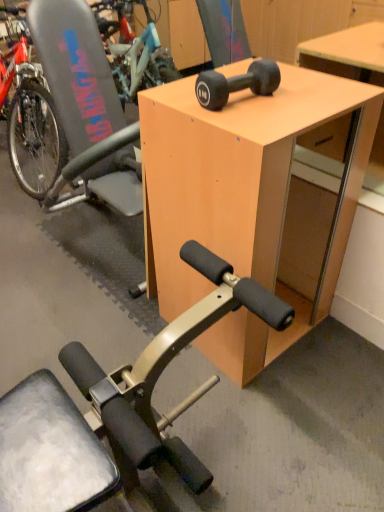
Question: Can you confirm if gray plastic swivel chair at left is bigger than black rubber dumbbell at upper center?

Choices:
 (A) yes
 (B) no

Answer: (A)

Question: Considering the relative sizes of gray plastic swivel chair at left and black rubber dumbbell at upper center in the image provided, is gray plastic swivel chair at left shorter than black rubber dumbbell at upper center?

Choices:
 (A) yes
 (B) no

Answer: (B)

Question: Is gray plastic swivel chair at left smaller than black rubber dumbbell at upper center?

Choices:
 (A) no
 (B) yes

Answer: (A)

Question: From a real-world perspective, is gray plastic swivel chair at left physically above black rubber dumbbell at upper center?

Choices:
 (A) yes
 (B) no

Answer: (B)

Question: Is the depth of gray plastic swivel chair at left less than that of black rubber dumbbell at upper center?

Choices:
 (A) no
 (B) yes

Answer: (A)

Question: Is gray plastic swivel chair at left looking in the opposite direction of black rubber dumbbell at upper center?

Choices:
 (A) yes
 (B) no

Answer: (B)

Question: Can you confirm if black rubber dumbbell at upper center is positioned to the left of light wood desk at center?

Choices:
 (A) no
 (B) yes

Answer: (B)

Question: From a real-world perspective, is black rubber dumbbell at upper center beneath light wood desk at center?

Choices:
 (A) yes
 (B) no

Answer: (B)

Question: Is black rubber dumbbell at upper center looking in the opposite direction of light wood desk at center?

Choices:
 (A) no
 (B) yes

Answer: (A)

Question: Is black rubber dumbbell at upper center further to the viewer compared to light wood desk at center?

Choices:
 (A) no
 (B) yes

Answer: (B)

Question: From a real-world perspective, is black rubber dumbbell at upper center on light wood desk at center?

Choices:
 (A) yes
 (B) no

Answer: (A)

Question: Considering the relative sizes of black rubber dumbbell at upper center and light wood desk at center in the image provided, is black rubber dumbbell at upper center smaller than light wood desk at center?

Choices:
 (A) no
 (B) yes

Answer: (B)

Question: From a real-world perspective, is black rubber dumbbell at upper center positioned over gray plastic swivel chair at left based on gravity?

Choices:
 (A) no
 (B) yes

Answer: (B)